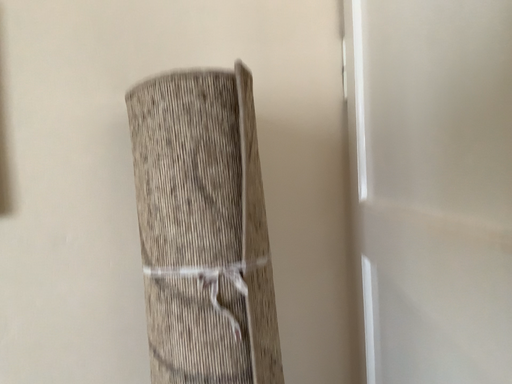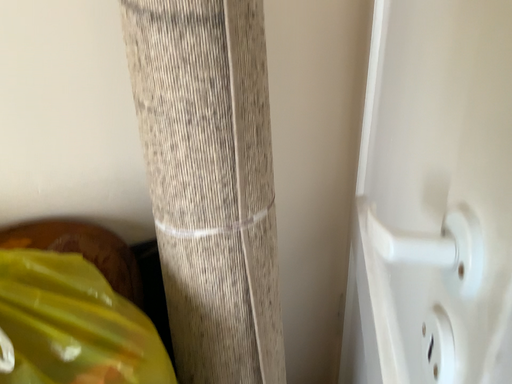
Question: Which way did the camera rotate in the video?

Choices:
 (A) rotated upward
 (B) rotated downward

Answer: (B)